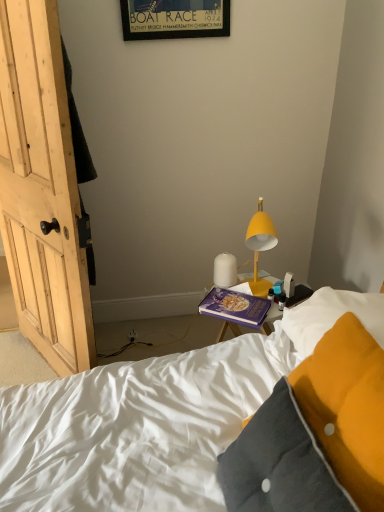
You are a GUI agent. You are given a task and a screenshot of the screen. Output one action in this format:
    pyautogui.click(x=<x>, y=<y>)
    Task: Click on the purple matte book at center
    The image size is (384, 512).
    Given the screenshot: What is the action you would take?
    pyautogui.click(x=235, y=307)

What do you see at coordinates (174, 19) in the screenshot? The height and width of the screenshot is (512, 384). I see `wooden framed poster at upper center` at bounding box center [174, 19].

Where is `white matte lamp at center, which is counted as the 2th lamp, starting from the right`? The height and width of the screenshot is (512, 384). white matte lamp at center, which is counted as the 2th lamp, starting from the right is located at coordinates (225, 270).

In terms of width, does wooden framed poster at upper center look wider or thinner when compared to yellow matte lamp at upper right, arranged as the first lamp when viewed from the right?

In the image, wooden framed poster at upper center appears to be more narrow than yellow matte lamp at upper right, arranged as the first lamp when viewed from the right.

From a real-world perspective, who is located lower, wooden framed poster at upper center or yellow matte lamp at upper right, arranged as the first lamp when viewed from the right?

In real-world perspective, yellow matte lamp at upper right, arranged as the first lamp when viewed from the right, is lower.

Considering the relative sizes of wooden framed poster at upper center and yellow matte lamp at upper right, arranged as the 2th lamp when viewed from the left, in the image provided, is wooden framed poster at upper center shorter than yellow matte lamp at upper right, arranged as the 2th lamp when viewed from the left,?

Yes.

From the image's perspective, who appears lower, wooden framed poster at upper center or yellow matte lamp at upper right, arranged as the first lamp when viewed from the right?

yellow matte lamp at upper right, arranged as the first lamp when viewed from the right.

From a real-world perspective, between white matte lamp at center, marked as the 1th lamp in a left-to-right arrangement, and yellow matte lamp at upper right, arranged as the first lamp when viewed from the right, who is vertically lower?

In real-world perspective, white matte lamp at center, marked as the 1th lamp in a left-to-right arrangement, is lower.

I want to click on lamp below the yellow matte lamp at upper right, arranged as the first lamp when viewed from the right (from a real-world perspective), so click(225, 270).

Can you tell me how much white matte lamp at center, which is counted as the 2th lamp, starting from the right, and yellow matte lamp at upper right, arranged as the 2th lamp when viewed from the left, differ in facing direction?

There is a 59.1-degree angle between the facing directions of white matte lamp at center, which is counted as the 2th lamp, starting from the right, and yellow matte lamp at upper right, arranged as the 2th lamp when viewed from the left.

Who is bigger, white matte lamp at center, marked as the 1th lamp in a left-to-right arrangement, or yellow matte lamp at upper right, arranged as the 2th lamp when viewed from the left?

With larger size is yellow matte lamp at upper right, arranged as the 2th lamp when viewed from the left.

Is point (248, 303) closer or farther from the camera than point (235, 278)?

Clearly, point (248, 303) is closer to the camera than point (235, 278).

Considering the positions of objects purple matte book at center and white matte lamp at center, which is counted as the 2th lamp, starting from the right, in the image provided, who is more to the right, purple matte book at center or white matte lamp at center, which is counted as the 2th lamp, starting from the right,?

purple matte book at center is more to the right.

How far apart are purple matte book at center and white matte lamp at center, which is counted as the 2th lamp, starting from the right?

12.23 centimeters.

Is white matte lamp at center, marked as the 1th lamp in a left-to-right arrangement, at the back of purple matte book at center?

No, purple matte book at center is not facing the opposite direction of white matte lamp at center, marked as the 1th lamp in a left-to-right arrangement.

Is yellow matte lamp at upper right, arranged as the first lamp when viewed from the right, placed right next to wooden framed poster at upper center?

No, yellow matte lamp at upper right, arranged as the first lamp when viewed from the right, is not in contact with wooden framed poster at upper center.

Is yellow matte lamp at upper right, arranged as the first lamp when viewed from the right, located outside wooden framed poster at upper center?

Absolutely, yellow matte lamp at upper right, arranged as the first lamp when viewed from the right, is external to wooden framed poster at upper center.

Which point is more distant from viewer, (258, 232) or (172, 21)?

The point (172, 21) is behind.

Consider the image. Between yellow matte lamp at upper right, arranged as the first lamp when viewed from the right, and purple matte book at center, which one has smaller size?

purple matte book at center is smaller.

Is the depth of yellow matte lamp at upper right, arranged as the 2th lamp when viewed from the left, greater than that of purple matte book at center?

No, yellow matte lamp at upper right, arranged as the 2th lamp when viewed from the left, is closer to the viewer.

From the image's perspective, is yellow matte lamp at upper right, arranged as the first lamp when viewed from the right, on top of purple matte book at center?

Correct, yellow matte lamp at upper right, arranged as the first lamp when viewed from the right, appears higher than purple matte book at center in the image.

From the image's perspective, which lamp is the 2nd one below the wooden framed poster at upper center? Please provide its 2D coordinates.

[(225, 270)]

Is wooden framed poster at upper center smaller than white matte lamp at center, which is counted as the 2th lamp, starting from the right?

No.

From a real-world perspective, is wooden framed poster at upper center physically above white matte lamp at center, which is counted as the 2th lamp, starting from the right?

Yes, from a real-world perspective, wooden framed poster at upper center is over white matte lamp at center, which is counted as the 2th lamp, starting from the right

Is wooden framed poster at upper center wider or thinner than white matte lamp at center, marked as the 1th lamp in a left-to-right arrangement?

Clearly, wooden framed poster at upper center has less width compared to white matte lamp at center, marked as the 1th lamp in a left-to-right arrangement.

Which is behind, point (231, 270) or point (179, 15)?

The point (179, 15) is farther from the camera.

Is white matte lamp at center, marked as the 1th lamp in a left-to-right arrangement, oriented away from wooden framed poster at upper center?

No, wooden framed poster at upper center is not at the back of white matte lamp at center, marked as the 1th lamp in a left-to-right arrangement.

Is white matte lamp at center, marked as the 1th lamp in a left-to-right arrangement, closer to the viewer compared to wooden framed poster at upper center?

No, white matte lamp at center, marked as the 1th lamp in a left-to-right arrangement, is further to the viewer.

From a real-world perspective, relative to wooden framed poster at upper center, is white matte lamp at center, marked as the 1th lamp in a left-to-right arrangement, vertically above or below?

From a real-world perspective, white matte lamp at center, marked as the 1th lamp in a left-to-right arrangement, is physically below wooden framed poster at upper center.

From a real-world perspective, starting from the wooden framed poster at upper center, which lamp is the 1st one below it? Please provide its 2D coordinates.

[(260, 246)]

Identify the location of lamp in front of the white matte lamp at center, which is counted as the 2th lamp, starting from the right. click(260, 246).

When comparing their distances from velvet yellow pillow at lower right, does wooden framed poster at upper center or yellow matte lamp at upper right, arranged as the 2th lamp when viewed from the left, seem further?

wooden framed poster at upper center is positioned further to the anchor velvet yellow pillow at lower right.

From the image, which object appears to be nearer to white matte lamp at center, which is counted as the 2th lamp, starting from the right, wooden framed poster at upper center or purple matte book at center?

purple matte book at center is positioned closer to the anchor white matte lamp at center, which is counted as the 2th lamp, starting from the right.

From the image, which object appears to be farther from purple matte book at center, velvet yellow pillow at lower right or wooden framed poster at upper center?

Based on the image, wooden framed poster at upper center appears to be further to purple matte book at center.

Which object lies further to the anchor point purple matte book at center, white matte lamp at center, which is counted as the 2th lamp, starting from the right, or yellow matte lamp at upper right, arranged as the 2th lamp when viewed from the left?

yellow matte lamp at upper right, arranged as the 2th lamp when viewed from the left, is further to purple matte book at center.

Looking at the image, which one is located closer to wooden framed poster at upper center, velvet yellow pillow at lower right or white matte lamp at center, which is counted as the 2th lamp, starting from the right?

white matte lamp at center, which is counted as the 2th lamp, starting from the right, lies closer to wooden framed poster at upper center than the other object.

Looking at the image, which one is located closer to yellow matte lamp at upper right, arranged as the first lamp when viewed from the right, velvet yellow pillow at lower right or white matte lamp at center, which is counted as the 2th lamp, starting from the right?

white matte lamp at center, which is counted as the 2th lamp, starting from the right.

Based on their spatial positions, is white matte lamp at center, marked as the 1th lamp in a left-to-right arrangement, or velvet yellow pillow at lower right further from yellow matte lamp at upper right, arranged as the first lamp when viewed from the right?

velvet yellow pillow at lower right.

Estimate the real-world distances between objects in this image. Which object is closer to wooden framed poster at upper center, yellow matte lamp at upper right, arranged as the first lamp when viewed from the right, or white matte lamp at center, marked as the 1th lamp in a left-to-right arrangement?

Among the two, yellow matte lamp at upper right, arranged as the first lamp when viewed from the right, is located nearer to wooden framed poster at upper center.

At what (x,y) coordinates should I click in order to perform the action: click on book between velvet yellow pillow at lower right and white matte lamp at center, which is counted as the 2th lamp, starting from the right, in the front-back direction. Please return your answer as a coordinate pair (x, y). Image resolution: width=384 pixels, height=512 pixels. Looking at the image, I should click on [235, 307].

Find the location of a particular element. This screenshot has height=512, width=384. book between wooden framed poster at upper center and velvet yellow pillow at lower right from top to bottom is located at coordinates (235, 307).

I want to click on lamp located between velvet yellow pillow at lower right and white matte lamp at center, which is counted as the 2th lamp, starting from the right, in the depth direction, so click(x=260, y=246).

Find the location of a particular element. The width and height of the screenshot is (384, 512). lamp between velvet yellow pillow at lower right and purple matte book at center in the front-back direction is located at coordinates click(x=260, y=246).